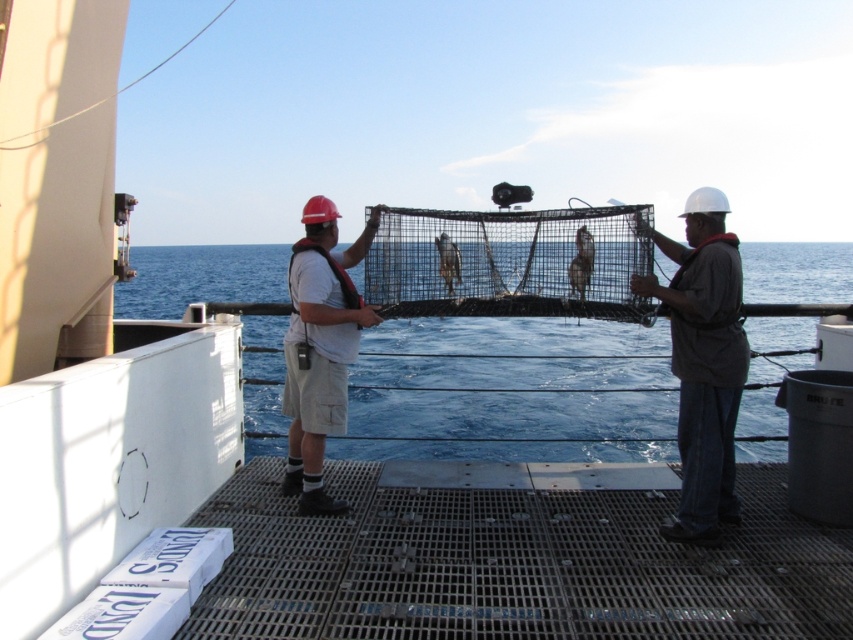
Consider the image. Is blue water at center to the right of brown matte fish at center from the viewer's perspective?

Indeed, blue water at center is positioned on the right side of brown matte fish at center.

Who is more forward, (251,355) or (445,234)?

Point (445,234) is in front.

Locate an element on the screen. The height and width of the screenshot is (640, 853). blue water at center is located at coordinates (509, 408).

Does point (758, 323) come closer to viewer compared to point (576, 269)?

No, it is behind (576, 269).

Is blue water at center to the left of shiny silver fish at center from the viewer's perspective?

In fact, blue water at center is to the right of shiny silver fish at center.

Is point (741, 246) behind point (577, 273)?

Yes.

Find the location of a particular element. The width and height of the screenshot is (853, 640). blue water at center is located at coordinates (509, 408).

Does white matte shirt at center come behind shiny silver fish at center?

No, it is not.

Who is more distant from viewer, (357, 298) or (577, 241)?

Positioned behind is point (577, 241).

Measure the distance between point (289, 449) and camera.

They are 5.31 meters apart.

Image resolution: width=853 pixels, height=640 pixels. Identify the location of white matte shirt at center. (320, 348).